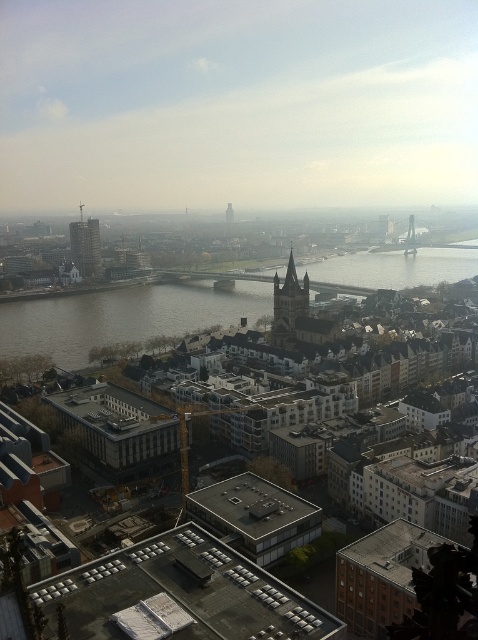
Question: Which of these objects is positioned farthest from the brown water at center?

Choices:
 (A) dark brown stone tower at center
 (B) matte glass skyscraper at center-left

Answer: (B)

Question: From the image, what is the correct spatial relationship of brown water at center in relation to smooth stone tower at center?

Choices:
 (A) above
 (B) below

Answer: (B)

Question: Which point is closer to the camera?

Choices:
 (A) brown water at center
 (B) smooth stone tower at center

Answer: (A)

Question: Can you confirm if brown water at center is positioned to the left of matte glass skyscraper at center-left?

Choices:
 (A) yes
 (B) no

Answer: (B)

Question: Is the position of brown water at center less distant than that of dark brown stone tower at center?

Choices:
 (A) yes
 (B) no

Answer: (B)

Question: Estimate the real-world distances between objects in this image. Which object is farther from the matte glass skyscraper at center-left?

Choices:
 (A) brown water at center
 (B) dark brown stone tower at center

Answer: (B)